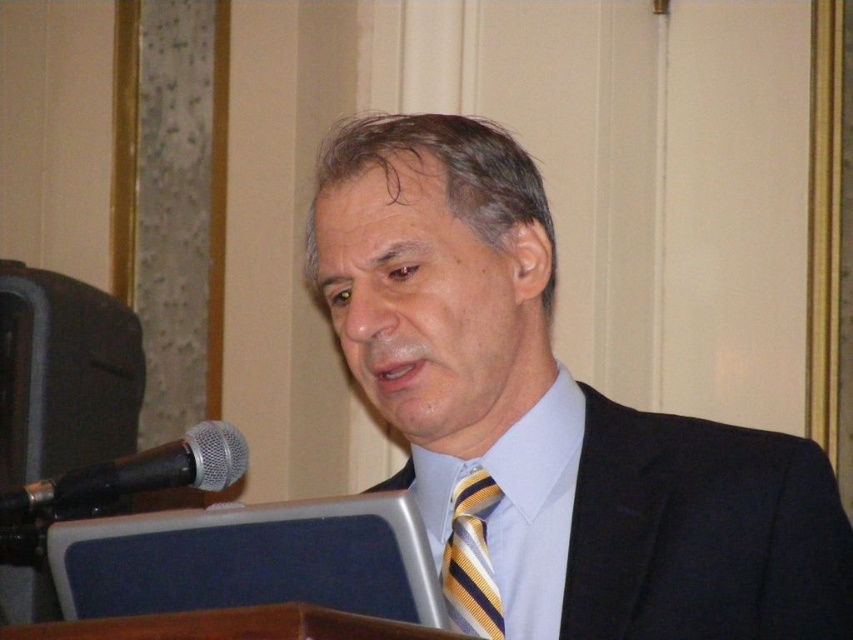
You are an attendee at the event and want to take a photo of the speaker. The black metallic microphone at left and the yellow striped tie at center are both in your camera frame. Which object should you focus on to ensure the photo is in sharp focus?

You should focus on the black metallic microphone at left because it is closer to the viewer than the yellow striped tie at center, so it will be in focus if you focus on it.